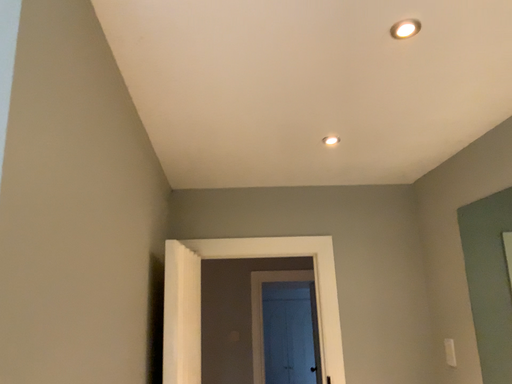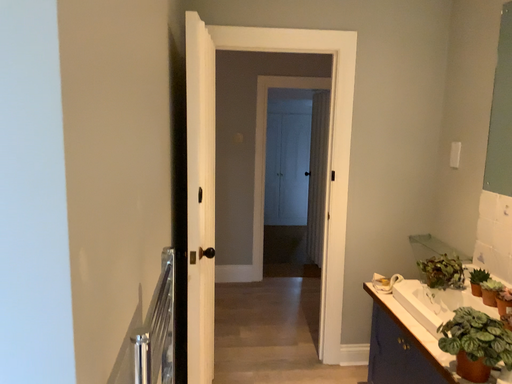
Question: How did the camera likely rotate when shooting the video?

Choices:
 (A) rotated upward
 (B) rotated downward

Answer: (B)